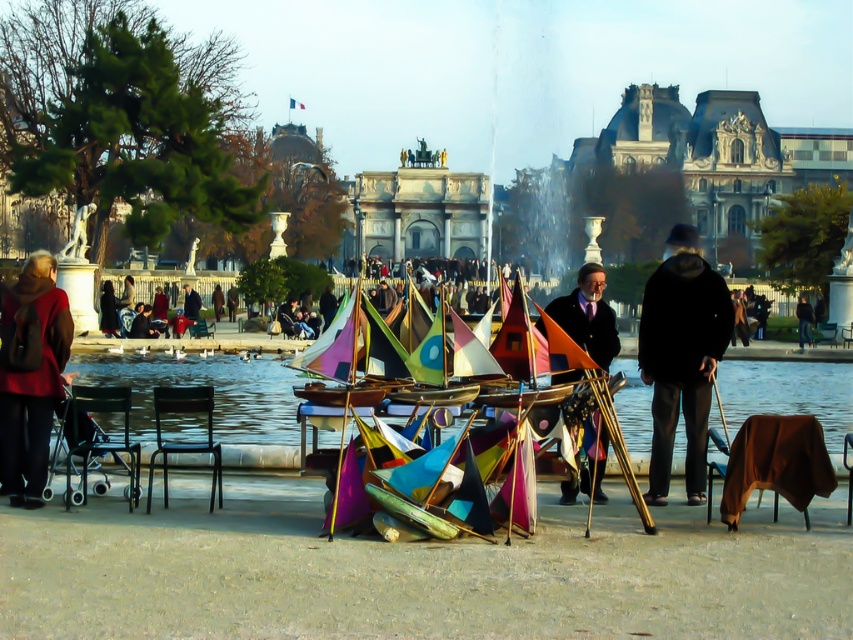
Is point (705, 387) farther from viewer compared to point (592, 332)?

No, (705, 387) is in front of (592, 332).

Can you confirm if black fabric cane at center is smaller than matte black coat at center?

Correct, black fabric cane at center occupies less space than matte black coat at center.

Between point (685, 413) and point (589, 324), which one is positioned behind?

Point (589, 324)

Locate an element on the screen. black fabric cane at center is located at coordinates (682, 356).

Is black fabric cane at center positioned behind matte red coat at left?

Yes.

Is point (660, 452) positioned after point (28, 273)?

No, it is in front of (28, 273).

The height and width of the screenshot is (640, 853). Find the location of `black fabric cane at center`. black fabric cane at center is located at coordinates click(x=682, y=356).

Which is more to the right, matte black coat at center or black leather jacket at center?

black leather jacket at center is more to the right.

Can you confirm if matte black coat at center is bigger than black leather jacket at center?

Yes, matte black coat at center is bigger than black leather jacket at center.

You are a GUI agent. You are given a task and a screenshot of the screen. Output one action in this format:
    pyautogui.click(x=<x>, y=<y>)
    Task: Click on the matte black coat at center
    Image resolution: width=853 pixels, height=640 pixels.
    Given the screenshot: What is the action you would take?
    pyautogui.click(x=589, y=316)